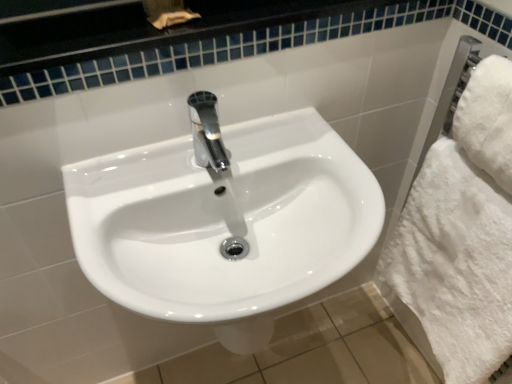
At what (x,y) coordinates should I click in order to perform the action: click on vacant location below white glossy sink at center (from a real-world perspective). Please return your answer as a coordinate pair (x, y). The width and height of the screenshot is (512, 384). Looking at the image, I should click on (247, 366).